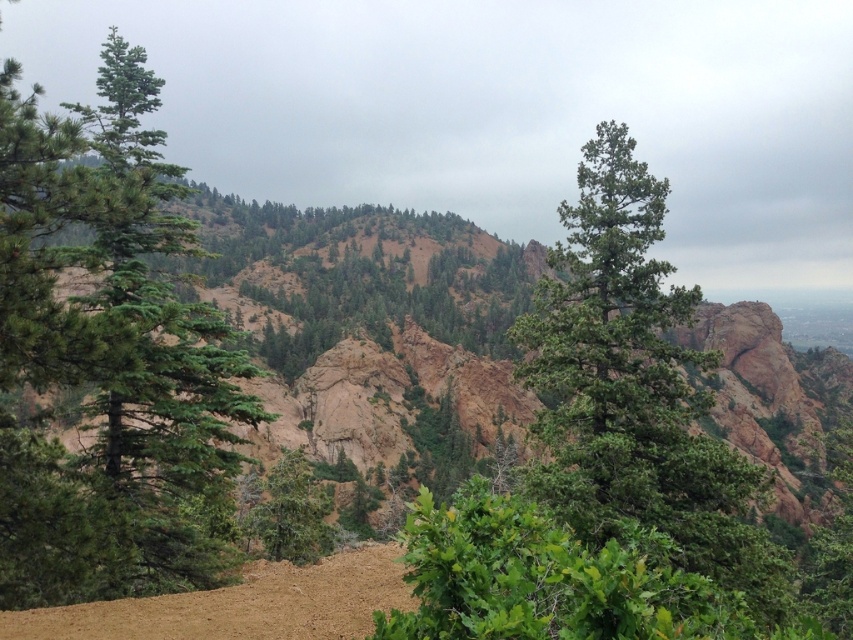
Question: Is green textured tree at center to the right of green matte tree at center from the viewer's perspective?

Choices:
 (A) yes
 (B) no

Answer: (A)

Question: Can you confirm if green textured tree at center is smaller than green matte tree at center?

Choices:
 (A) no
 (B) yes

Answer: (A)

Question: Which is farther from the green matte tree at left?

Choices:
 (A) green textured tree at center
 (B) green matte tree at center

Answer: (A)

Question: Which of the following is the farthest from the observer?

Choices:
 (A) green matte tree at left
 (B) green textured tree at center

Answer: (A)

Question: Is green matte tree at left above green matte tree at center?

Choices:
 (A) no
 (B) yes

Answer: (B)

Question: Which point is closer to the camera?

Choices:
 (A) green matte tree at left
 (B) green textured tree at center

Answer: (B)